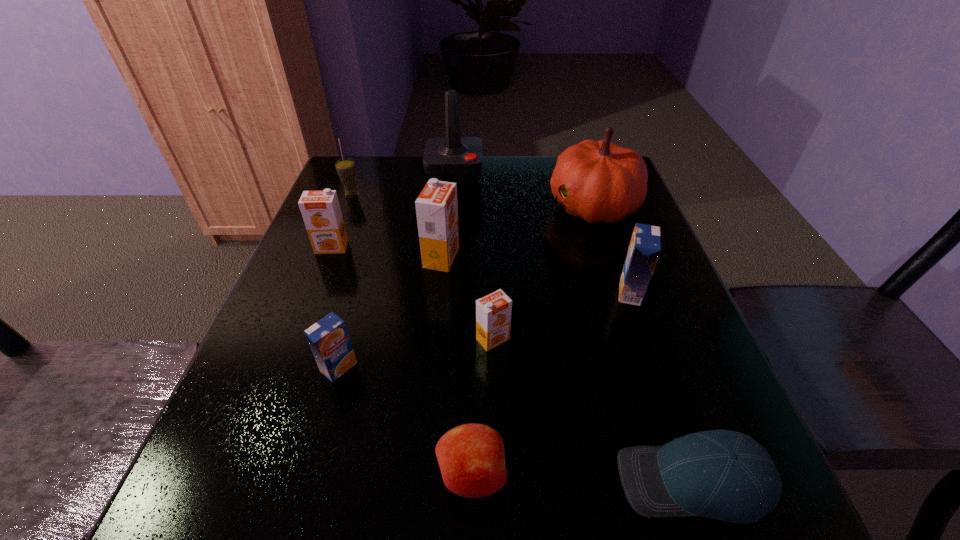
The image size is (960, 540). Identify the location of free point between the leftmost orange orange juice and the biggest orange orange juice. (387, 253).

Where is `vacant space that's between the leftmost orange orange juice and the joystick`? The height and width of the screenshot is (540, 960). vacant space that's between the leftmost orange orange juice and the joystick is located at coordinates (393, 209).

In order to click on free point between the leftmost orange juice and the pink pumpkin in this screenshot , I will do `click(463, 226)`.

Where is `vacant area that lies between the left blue orange_juice and the leftmost orange juice`? This screenshot has width=960, height=540. vacant area that lies between the left blue orange_juice and the leftmost orange juice is located at coordinates (335, 307).

Locate an element on the screen. Image resolution: width=960 pixels, height=540 pixels. vacant space in between the leftmost orange juice and the pink pumpkin is located at coordinates (463, 226).

At what (x,y) coordinates should I click in order to perform the action: click on object that is the fourth closest one to the joystick. Please return your answer as a coordinate pair (x, y). This screenshot has width=960, height=540. Looking at the image, I should click on (321, 212).

Choose which object is the fourth nearest neighbor to the leftmost orange orange juice. Please provide its 2D coordinates. Your answer should be formatted as a tuple, i.e. [(x, y)], where the tuple contains the x and y coordinates of a point satisfying the conditions above.

[(456, 159)]

Identify which orange juice is the second nearest to the second smallest orange orange juice. Please provide its 2D coordinates. Your answer should be formatted as a tuple, i.e. [(x, y)], where the tuple contains the x and y coordinates of a point satisfying the conditions above.

[(329, 340)]

The width and height of the screenshot is (960, 540). Identify the location of orange juice that is the third nearest to the third orange juice from right to left. (329, 340).

Locate an element on the screen. The image size is (960, 540). orange orange juice that is the third closest to the light baseball cap is located at coordinates (321, 212).